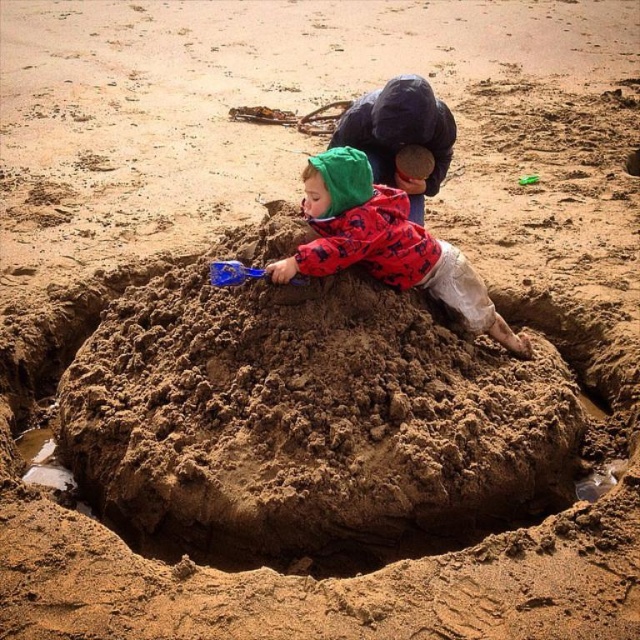
Can you confirm if matte red jacket at center is thinner than red plaid shirt at center?

Incorrect, matte red jacket at center's width is not less than red plaid shirt at center's.

Is matte red jacket at center smaller than red plaid shirt at center?

No, matte red jacket at center is not smaller than red plaid shirt at center.

This screenshot has width=640, height=640. Describe the element at coordinates (385, 243) in the screenshot. I see `matte red jacket at center` at that location.

Image resolution: width=640 pixels, height=640 pixels. Identify the location of matte red jacket at center. (385, 243).

Is red plaid shirt at center to the right of blue plastic shovel at center from the viewer's perspective?

Indeed, red plaid shirt at center is positioned on the right side of blue plastic shovel at center.

Which of these two, red plaid shirt at center or blue plastic shovel at center, stands taller?

With more height is red plaid shirt at center.

The image size is (640, 640). Find the location of `red plaid shirt at center`. red plaid shirt at center is located at coordinates (401, 134).

In the scene shown: Can you confirm if matte red jacket at center is shorter than blue plastic shovel at center?

In fact, matte red jacket at center may be taller than blue plastic shovel at center.

Does matte red jacket at center appear on the right side of blue plastic shovel at center?

Indeed, matte red jacket at center is positioned on the right side of blue plastic shovel at center.

Which is in front, point (476, 317) or point (227, 273)?

Point (227, 273) is more forward.

Locate an element on the screen. This screenshot has height=640, width=640. matte red jacket at center is located at coordinates (385, 243).